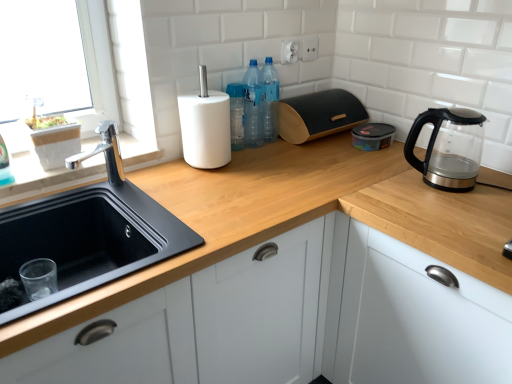
Locate an element on the screen. free space in front of translucent plastic bottles at upper center, the second bottle in the left-to-right sequence is located at coordinates (275, 150).